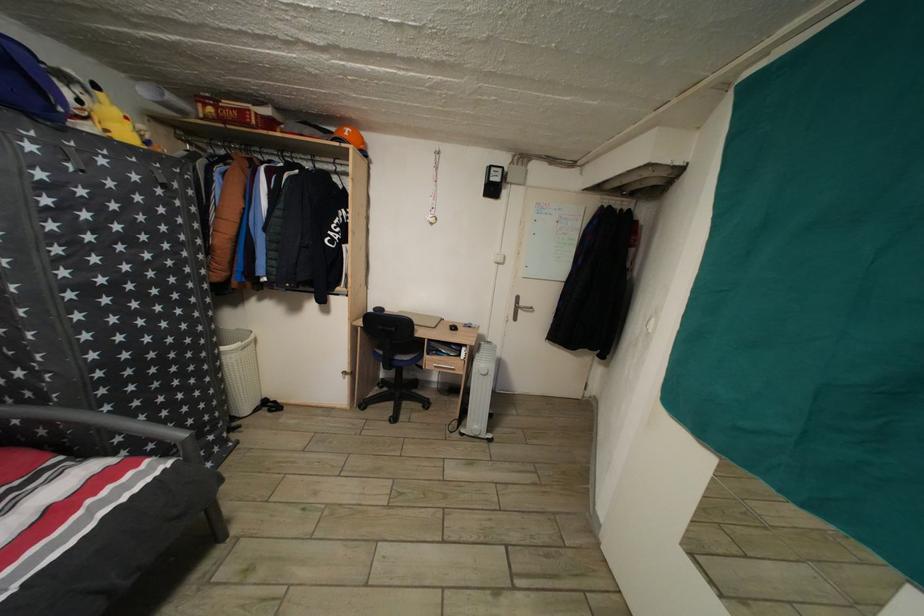
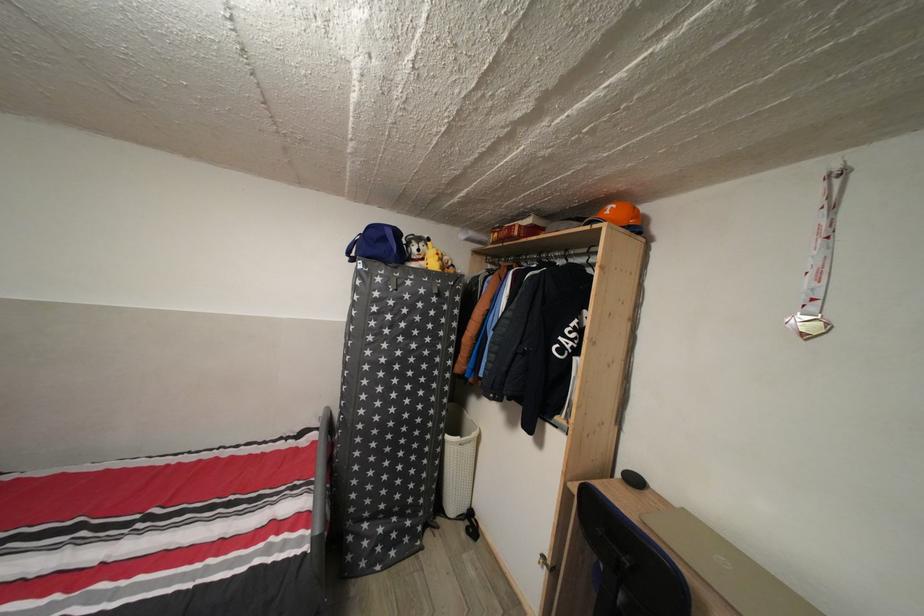
The point at (217, 116) is marked in the first image. Where is the corresponding point in the second image?

(503, 241)